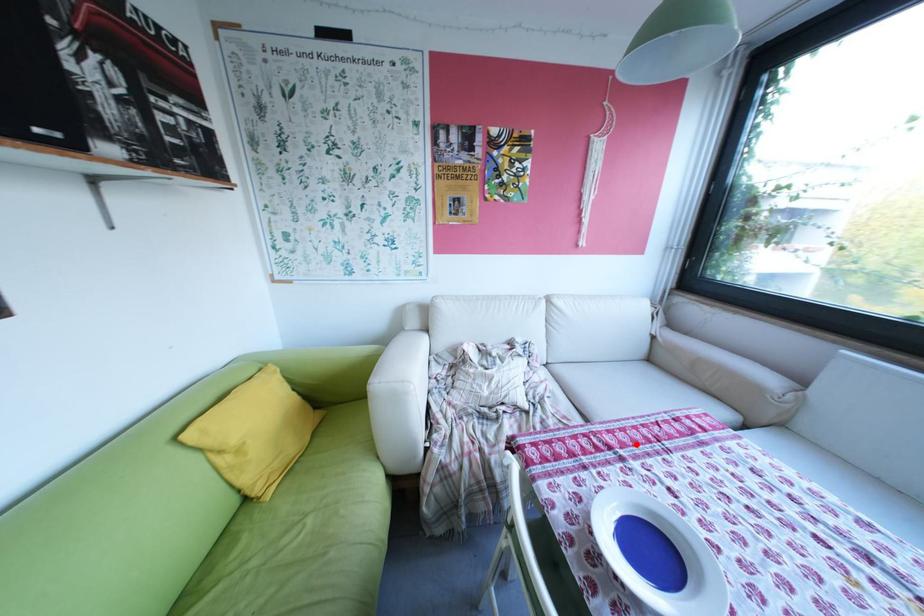
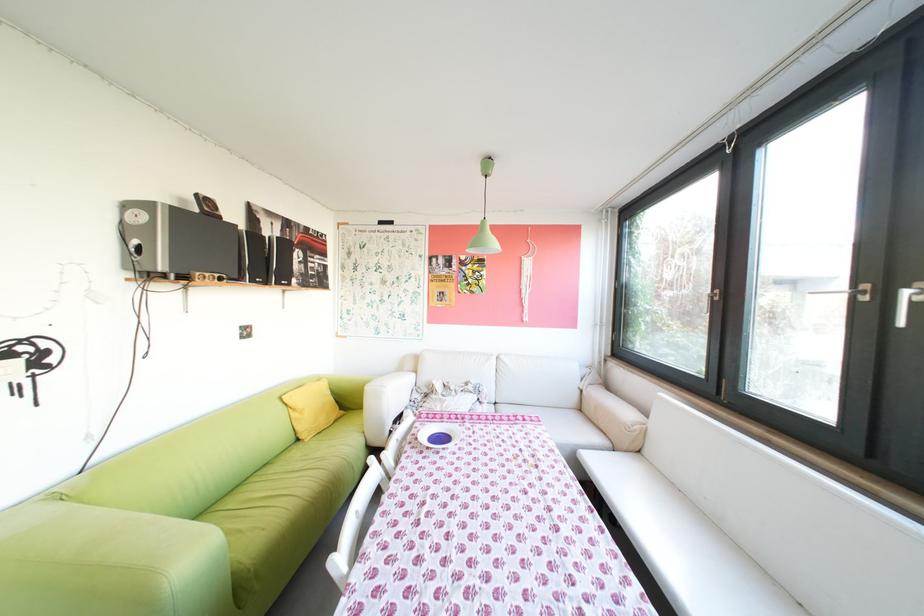
The point at the highlighted location is marked in the first image. Where is the corresponding point in the second image?

(484, 419)